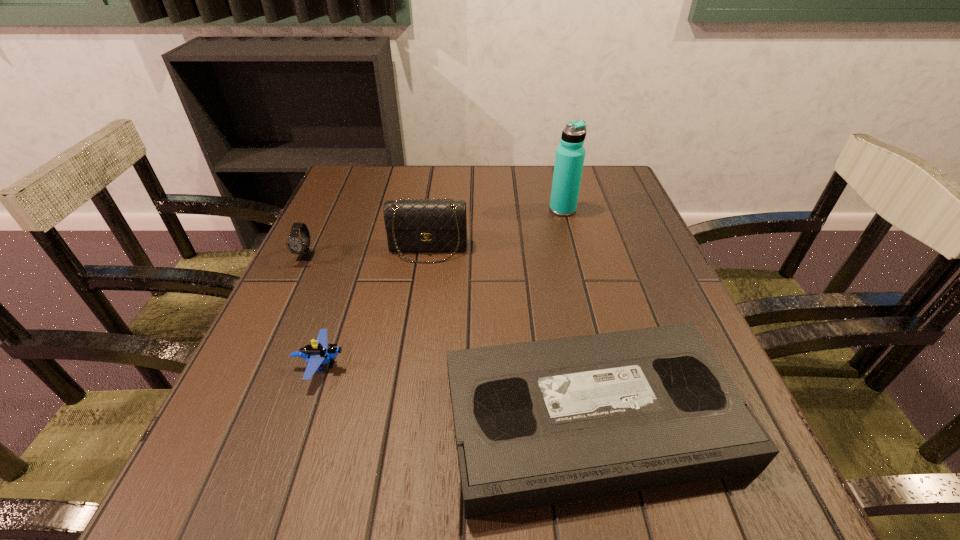
The width and height of the screenshot is (960, 540). Identify the location of the tallest object. click(x=569, y=160).

You are a GUI agent. You are given a task and a screenshot of the screen. Output one action in this format:
    pyautogui.click(x=<x>, y=<y>)
    Task: Click on the farthest object
    This screenshot has height=540, width=960.
    Given the screenshot: What is the action you would take?
    pyautogui.click(x=569, y=160)

This screenshot has height=540, width=960. In order to click on clutch bag in this screenshot , I will do `click(436, 225)`.

The image size is (960, 540). I want to click on the leftmost object, so click(x=296, y=245).

This screenshot has width=960, height=540. I want to click on the third shortest object, so click(296, 245).

At what (x,y) coordinates should I click in order to perform the action: click on the second object from left to right. Please return your answer as a coordinate pair (x, y). Looking at the image, I should click on [317, 353].

At what (x,y) coordinates should I click in order to perform the action: click on the shortest object. Please return your answer as a coordinate pair (x, y). This screenshot has width=960, height=540. Looking at the image, I should click on (539, 423).

You are a GUI agent. You are given a task and a screenshot of the screen. Output one action in this format:
    pyautogui.click(x=<x>, y=<y>)
    Task: Click on the free space located on the left of the water bottle
    The width and height of the screenshot is (960, 540).
    Given the screenshot: What is the action you would take?
    pyautogui.click(x=518, y=210)

Locate an element on the screen. The image size is (960, 540). free space located 0.310m on the front flap of the clutch bag is located at coordinates pyautogui.click(x=409, y=383).

Find the location of a particular element. This screenshot has width=960, height=540. vacant space situated on the face of the leftmost object is located at coordinates (247, 382).